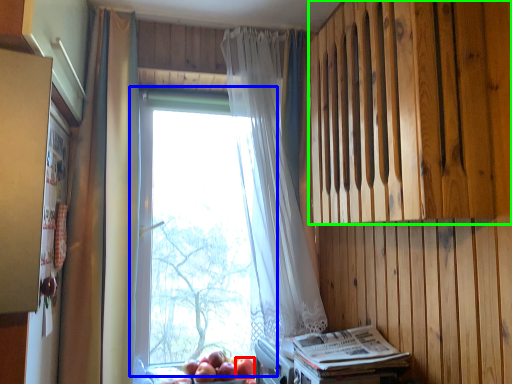
Question: Based on their relative distances, which object is nearer to apple (highlighted by a red box)? Choose from window (highlighted by a blue box) and wood (highlighted by a green box).

Choices:
 (A) window
 (B) wood

Answer: (A)